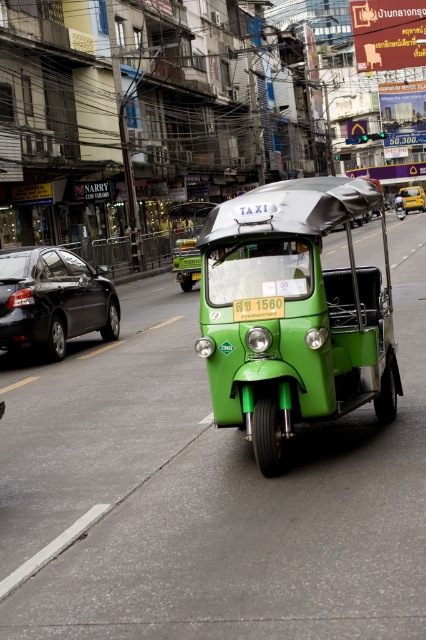
You are standing at the center of the street and see the point marked at coordinates (52, 300). What object is located at that point?

The point at coordinates (52, 300) corresponds to the shiny black sedan at left.

You are a pedestrian standing on the sidewalk and want to cross the street to reach the green plastic license plate at center. There is a shiny black sedan at left blocking your path. Can you walk around the sedan to reach the license plate?

The shiny black sedan at left is further to the viewer than green plastic license plate at center, so you can walk around the sedan to reach the license plate because it is closer to you.